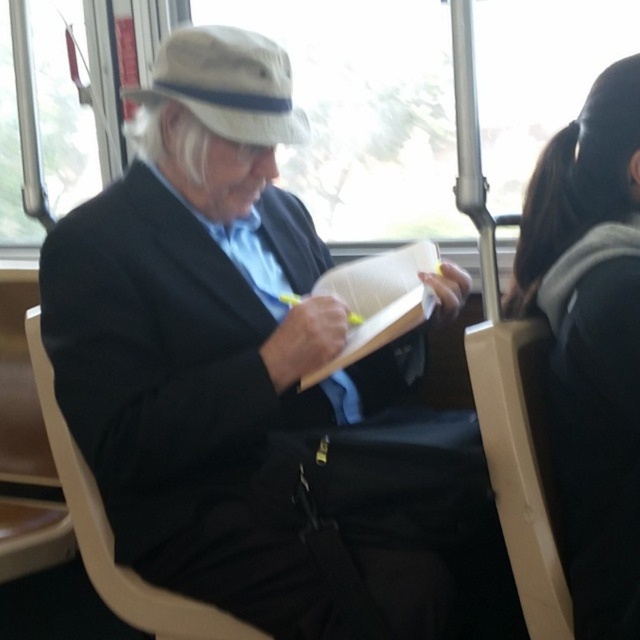
You are a passenger on a train and need to place your matte black book at center onto the beige plastic chair at left. Can you place it directly to the right side of the chair?

The matte black book at center is already positioned to the right of the beige plastic chair at left, so you can place it there directly.

You are a passenger on a train and want to place your matte black book at center on the beige plastic chair at left. Can you fit the book vertically on the chair?

The matte black book at center is taller than the beige plastic chair at left, so it cannot be placed vertically on the chair as it would not fit.

You are a passenger on a bus and you see the dark gray hair at upper right and the hardcover book at center. Which object is taller?

The dark gray hair at upper right is much taller as the hardcover book at center.